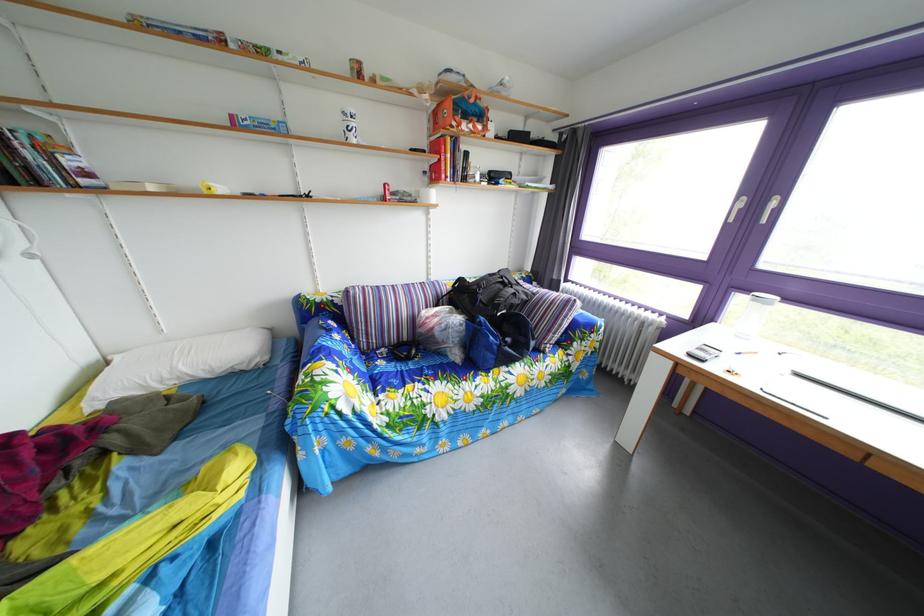
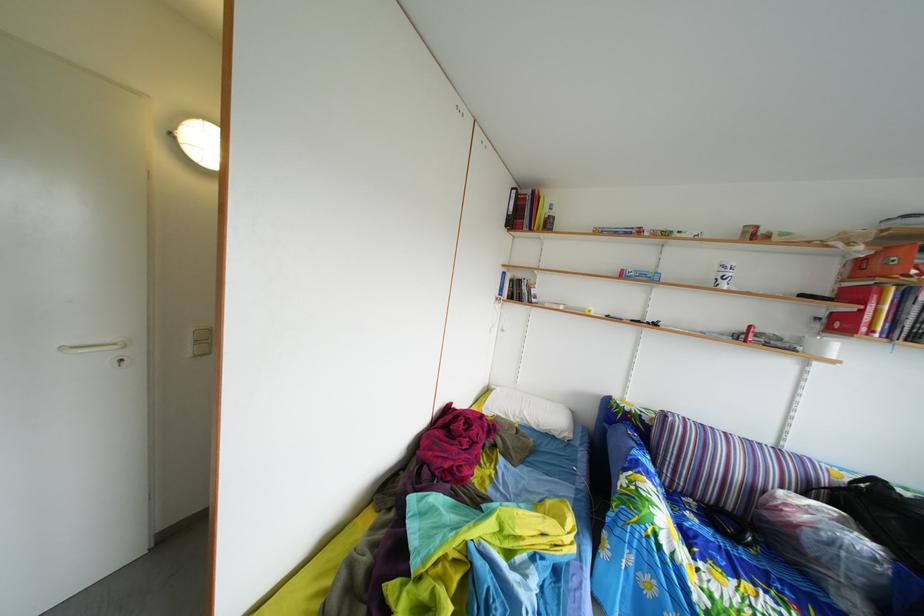
Locate, in the second image, the point that corresponds to [472,302] in the first image.

(886, 515)